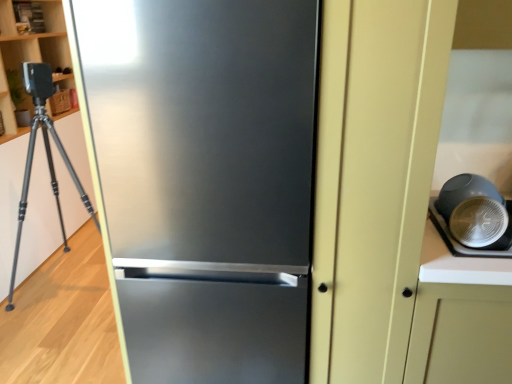
Question: Would you say stainless steel refrigerator at center is to the left or to the right of matte black bowl at right in the picture?

Choices:
 (A) left
 (B) right

Answer: (A)

Question: From a real-world perspective, is stainless steel refrigerator at center above or below matte black bowl at right?

Choices:
 (A) below
 (B) above

Answer: (A)

Question: Considering the positions of stainless steel refrigerator at center and matte black bowl at right in the image, is stainless steel refrigerator at center taller or shorter than matte black bowl at right?

Choices:
 (A) short
 (B) tall

Answer: (B)

Question: Considering the positions of point (504, 205) and point (180, 228), is point (504, 205) closer or farther from the camera than point (180, 228)?

Choices:
 (A) closer
 (B) farther

Answer: (B)

Question: Is matte black bowl at right inside the boundaries of stainless steel refrigerator at center, or outside?

Choices:
 (A) inside
 (B) outside

Answer: (B)

Question: Is matte black bowl at right taller or shorter than stainless steel refrigerator at center?

Choices:
 (A) tall
 (B) short

Answer: (B)

Question: From a real-world perspective, relative to stainless steel refrigerator at center, is matte black bowl at right vertically above or below?

Choices:
 (A) above
 (B) below

Answer: (A)